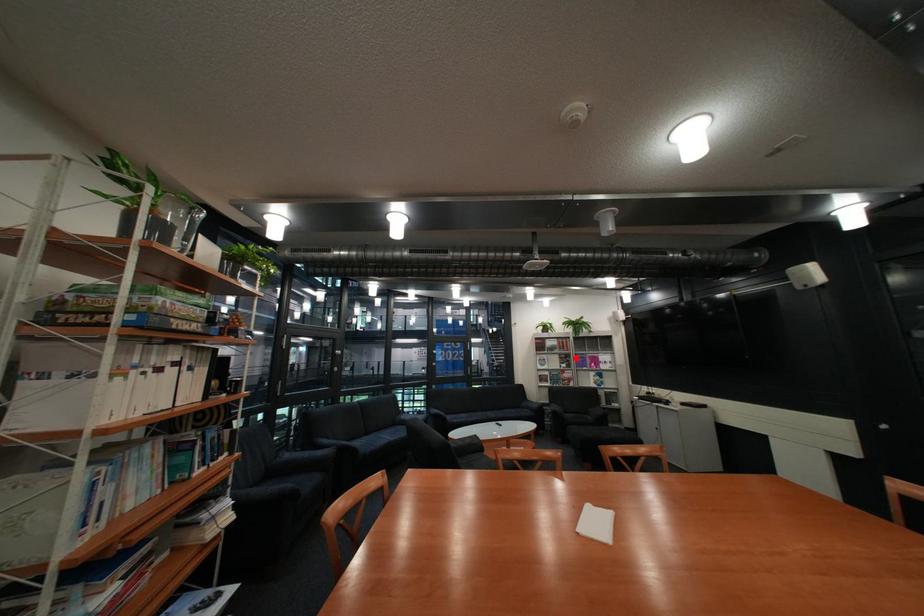
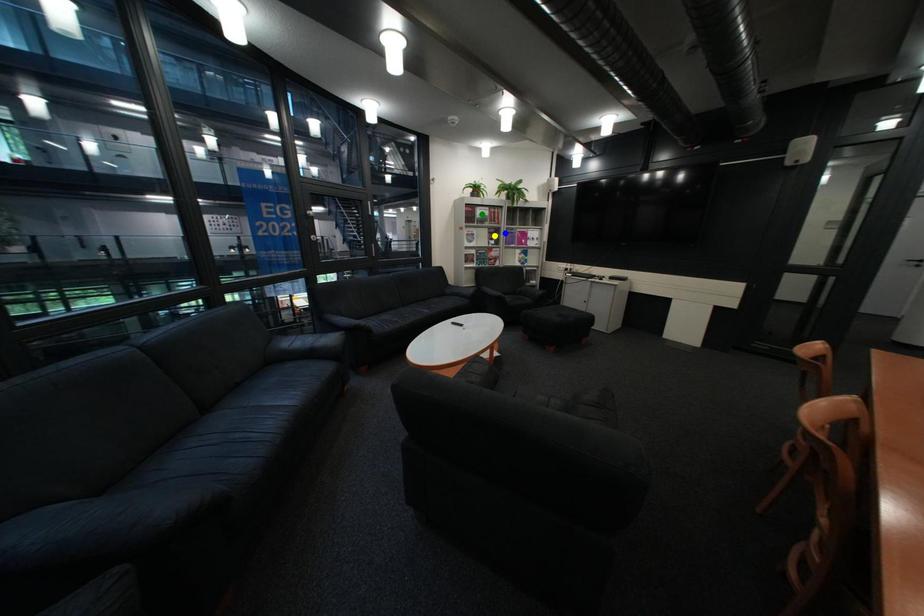
Question: I am providing you with two images of the same scene from different viewpoints. A red point is marked on the first image. You are given multiple points on the second image. Which spot in image 2 lines up with the point in image 1?

Choices:
 (A) yellow point
 (B) blue point
 (C) green point

Answer: (B)